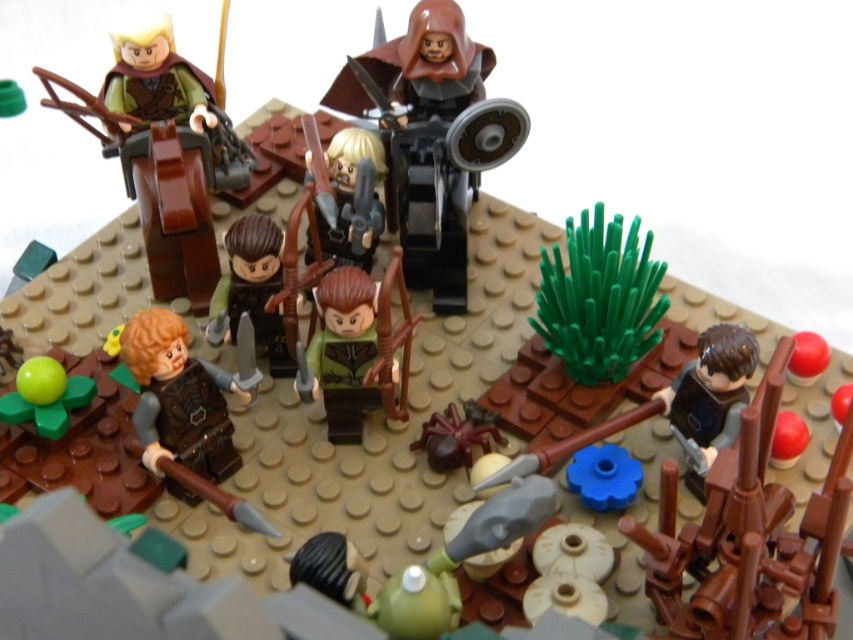
Question: From the image, what is the correct spatial relationship of brown matte helmet at center in relation to green matte minifigure at center?

Choices:
 (A) above
 (B) below

Answer: (A)

Question: Based on their relative distances, which object is nearer to the brown matte helmet at center?

Choices:
 (A) green matte minifigure at center
 (B) matte brown horse at upper left

Answer: (A)

Question: Can you confirm if brown matte sword at lower right is positioned below brown matte helmet at center?

Choices:
 (A) no
 (B) yes

Answer: (B)

Question: Which object is closer to the camera taking this photo?

Choices:
 (A) brown matte sword at lower right
 (B) green matte minifigure at center
 (C) brown matte helmet at center
 (D) matte brown horse at upper left

Answer: (A)

Question: Which is farther from the green matte minifigure at center?

Choices:
 (A) matte brown horse at upper left
 (B) brown matte helmet at center
 (C) brown matte sword at lower right

Answer: (C)

Question: Can you confirm if brown matte sword at lower right is thinner than matte brown horse at upper left?

Choices:
 (A) yes
 (B) no

Answer: (B)